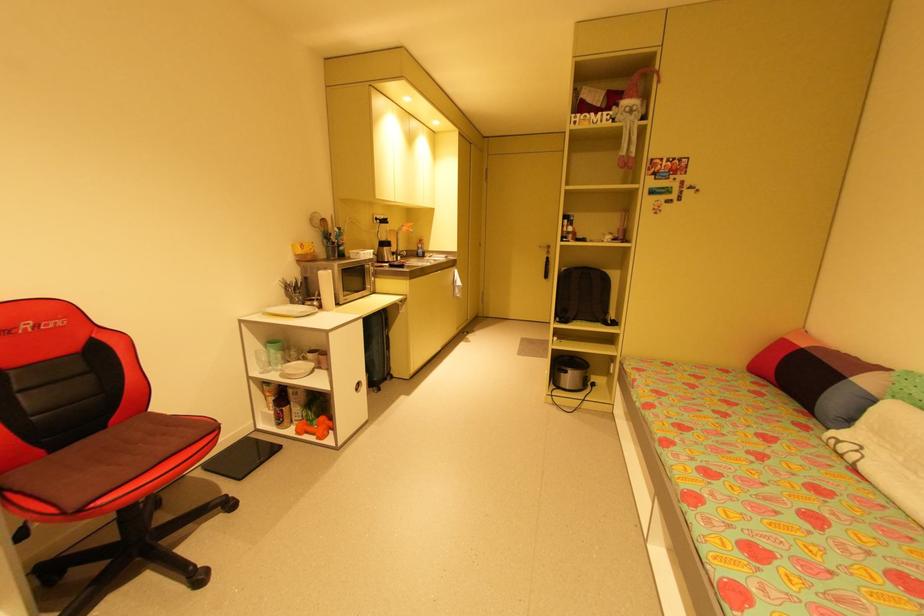
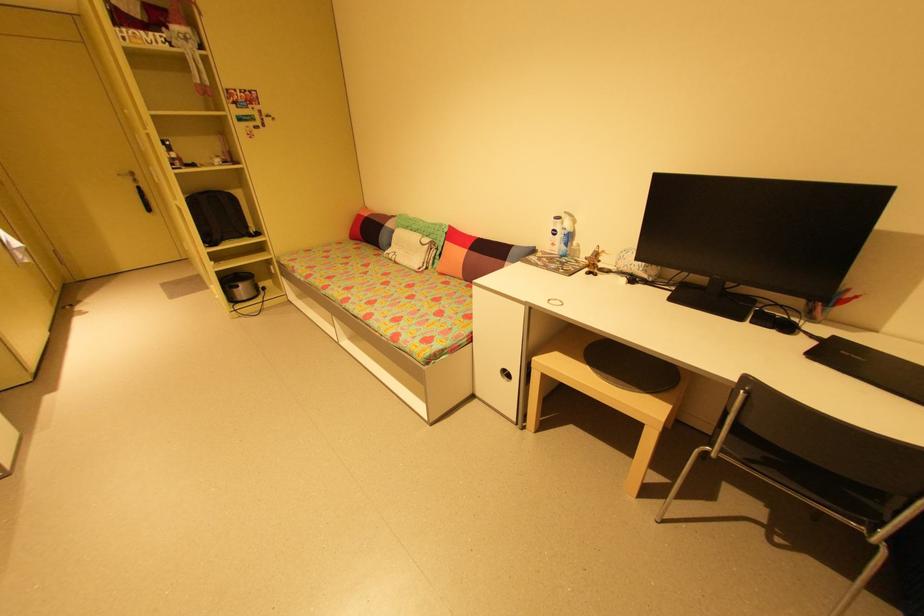
Where in the second image is the point corresponding to point 550,261 from the first image?

(140, 191)